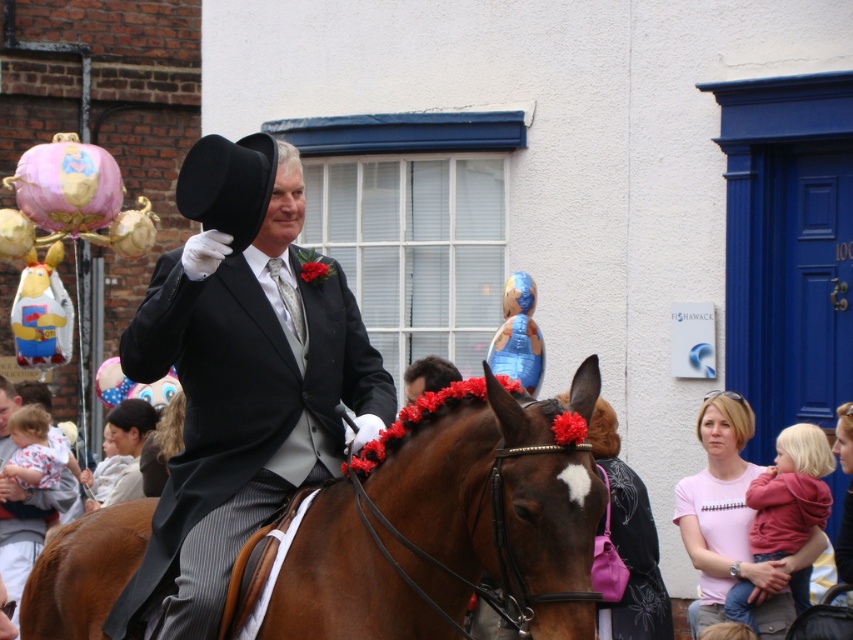
You are a photographer trying to capture the best shot of the parade. You notice two points marked in the image. The first point is at coordinates point (338, 504) and the second is at point (199, 557). Which point is closer to the camera?

Point (338, 504) is in front of point (199, 557), so it is closer to the camera.

You are a photographer standing in the middle of the street. You need to capture a photo that includes both the brown glossy horse at center and the matte black top hat at center. Since the horse is taller, will the top hat be visible in the photo if you focus on the horse?

The brown glossy horse at center is taller than the matte black top hat at center, so if you focus on the horse, the top hat will still be visible as it is positioned lower than the horse.

You are a photographer trying to capture the brown glossy horse at center and the matte black top hat at center in a single shot. Which object should you adjust your camera angle to focus on first if you want to ensure both are visible without moving the subjects?

The brown glossy horse at center is positioned on the right side of the matte black top hat at center. To capture both in a single shot, focus on the matte black top hat at center first since it is closer to the left, allowing the horse to naturally fall into the frame on the right.